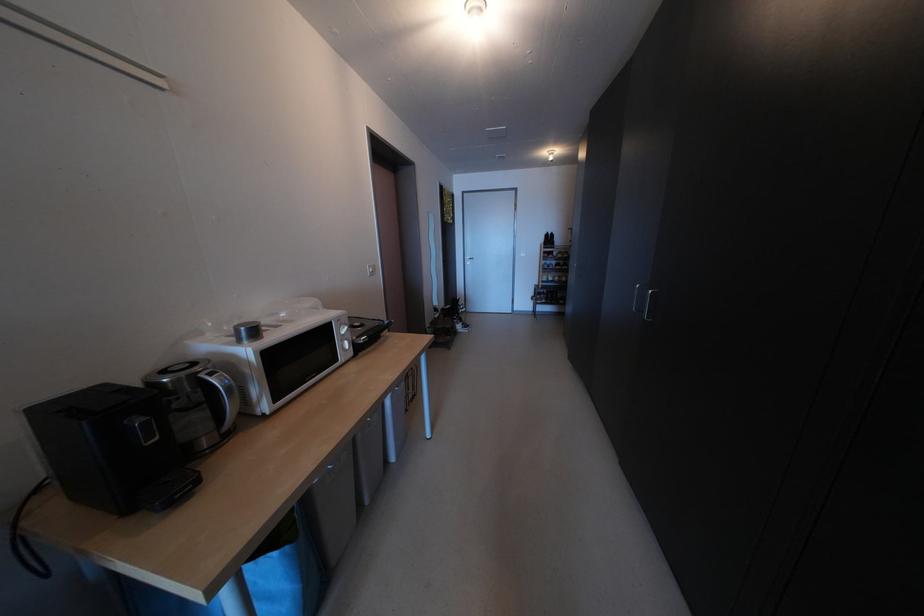
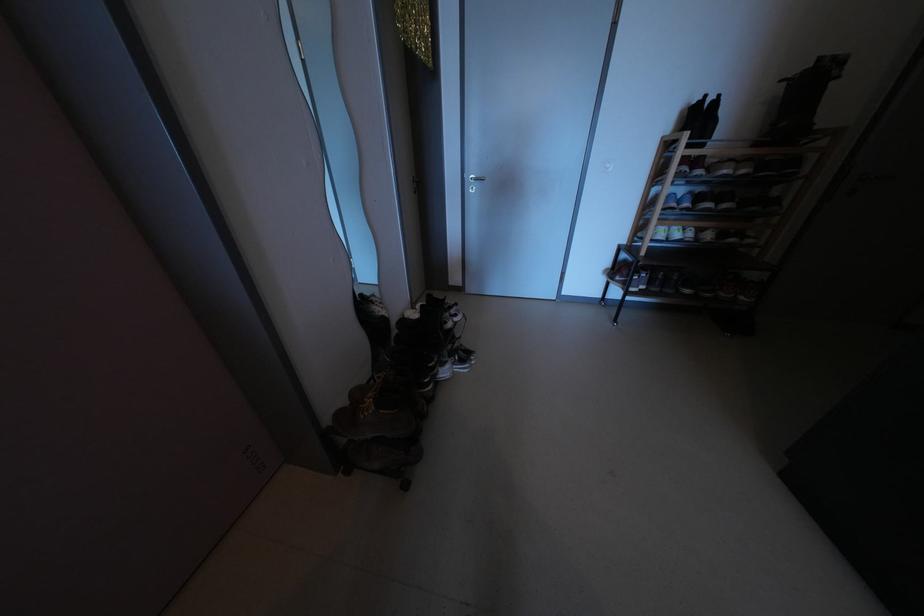
Question: The images are taken continuously from a first-person perspective. In which direction are you moving?

Choices:
 (A) Left
 (B) Right
 (C) Forward
 (D) Backward

Answer: (C)